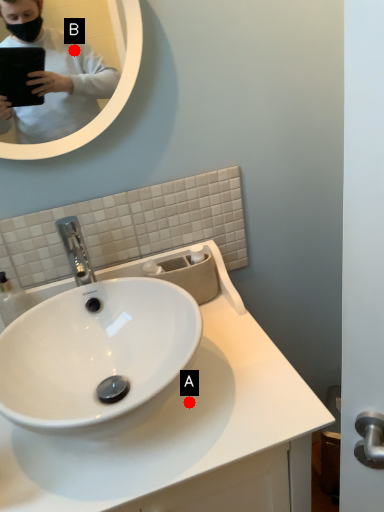
Question: Two points are circled on the image, labeled by A and B beside each circle. Among these points, which one is nearest to the camera?

Choices:
 (A) A is closer
 (B) B is closer

Answer: (A)